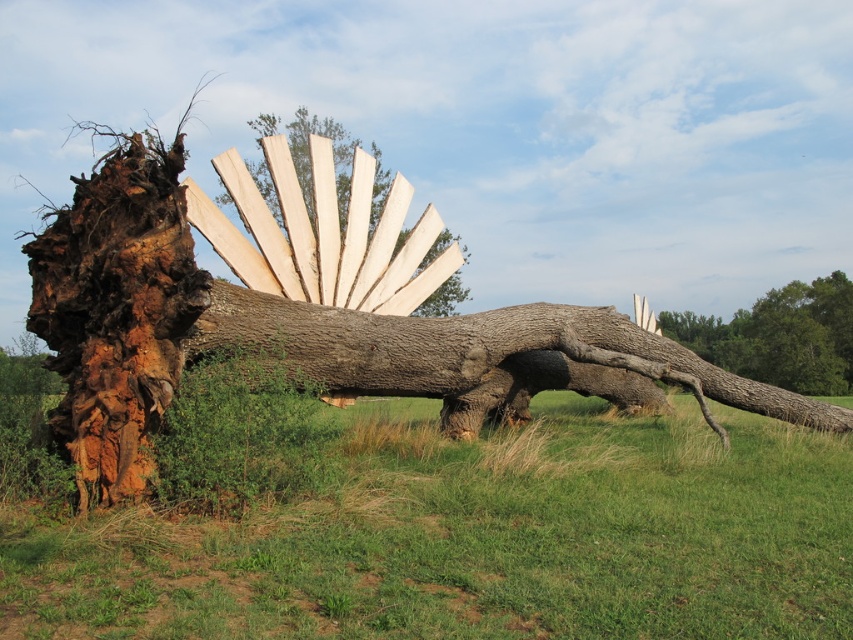
You are standing at the point labeled point [447,298] and want to walk to the tree trunk in the image. Which direction should you move relative to point [544,524]?

You should move towards point [544,524] because it is in front of point [447,298], so moving towards it would lead you closer to the tree trunk.

You are a gardener planning to place a decorative item in the field. You have the green grass at lower left and the natural wood fan at center. Which area has more space available for placing a larger decorative item?

The natural wood fan at center has more space available because its width is greater than the green grass at lower left.

You are an artist standing in the field and want to place a new sculpture between the rustic wood sculpture at left and the smooth bark tree trunk at right. Based on their positions, which direction should you move to place the new sculpture so it is between them?

The rustic wood sculpture at left is above the smooth bark tree trunk at right, so to place the new sculpture between them, you should move downward from the rustic wood sculpture at left towards the smooth bark tree trunk at right.